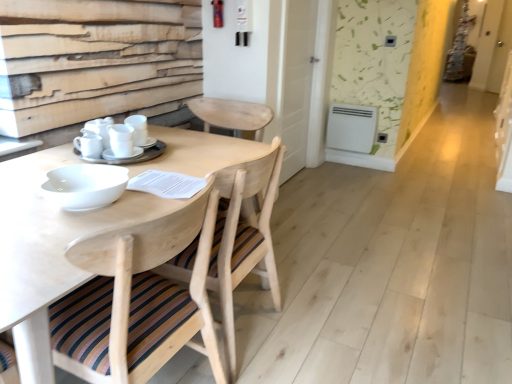
At what (x,y) coordinates should I click in order to perform the action: click on vacant location behind white matte cups at center, placed as the 1th tableware when sorted from right to left. Please return your answer as a coordinate pair (x, y). Looking at the image, I should click on (167, 136).